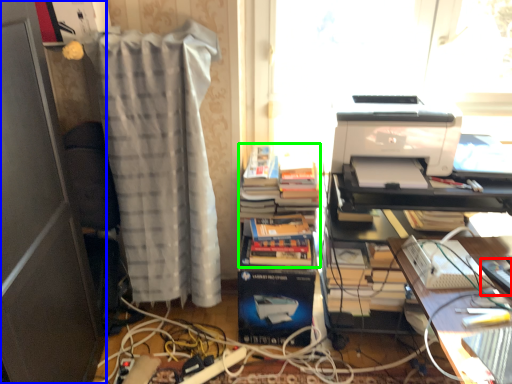
Question: Which object is positioned farthest from equipment (highlighted by a red box)? Select from file cabinet (highlighted by a blue box) and book (highlighted by a green box).

Choices:
 (A) file cabinet
 (B) book

Answer: (A)